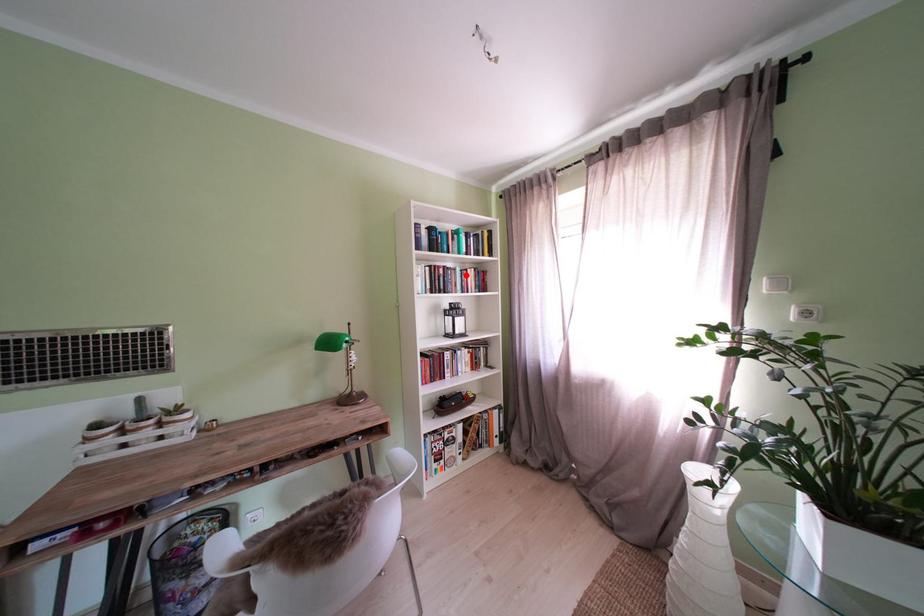
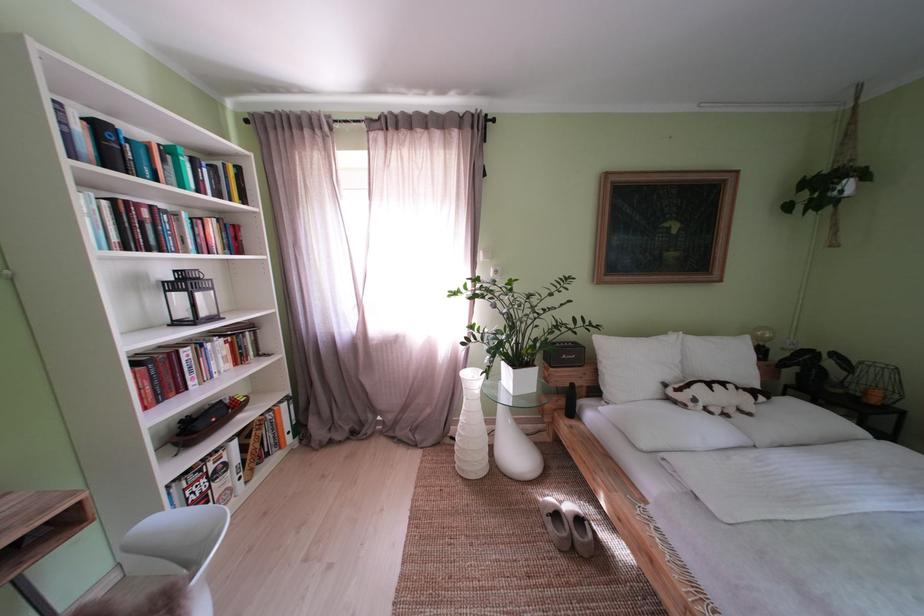
Find the pixel in the second image that matches the highlighted location in the first image.

(188, 220)